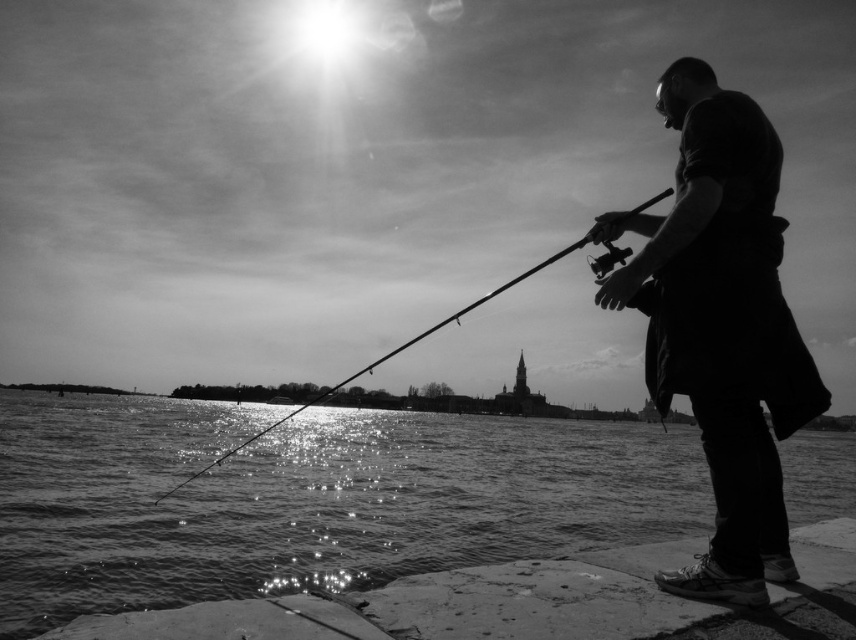
Question: Estimate the real-world distances between objects in this image. Which object is farther from the dark fabric shirt at right?

Choices:
 (A) sparkling water at lower center
 (B) smooth rod fishing pole at center

Answer: (B)

Question: Among these points, which one is nearest to the camera?

Choices:
 (A) (301, 410)
 (B) (742, 179)

Answer: (B)

Question: Can you confirm if dark fabric shirt at right is smaller than smooth rod fishing pole at center?

Choices:
 (A) no
 (B) yes

Answer: (B)

Question: From the image, what is the correct spatial relationship of dark fabric shirt at right in relation to smooth rod fishing pole at center?

Choices:
 (A) above
 (B) below

Answer: (A)

Question: Is sparkling water at lower center below dark fabric shirt at right?

Choices:
 (A) yes
 (B) no

Answer: (A)

Question: Which of the following is the farthest from the observer?

Choices:
 (A) (679, 260)
 (B) (333, 588)

Answer: (B)